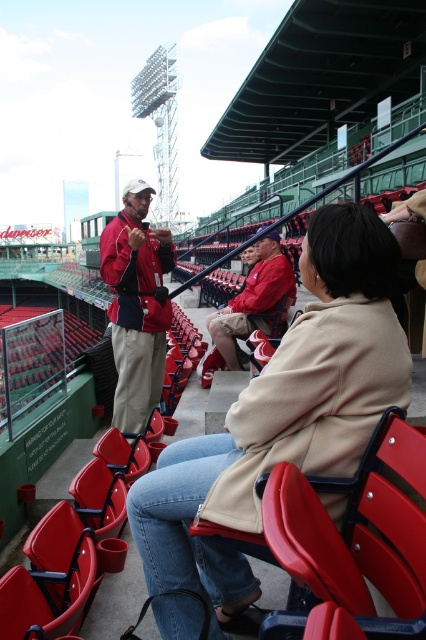
Question: Which of the following is the farthest from the observer?

Choices:
 (A) (135, 252)
 (B) (353, 609)
 (C) (235, 358)

Answer: (C)

Question: Is beige fabric coat at center wider than red fabric jacket at center?

Choices:
 (A) yes
 (B) no

Answer: (A)

Question: Is beige fabric coat at center wider than red fabric jacket at center?

Choices:
 (A) yes
 (B) no

Answer: (A)

Question: Which object is positioned closest to the matte red jacket at center?

Choices:
 (A) matte plastic chair at lower center
 (B) beige fabric coat at center
 (C) red fabric jacket at center

Answer: (C)

Question: Among these objects, which one is nearest to the camera?

Choices:
 (A) red fabric jacket at center
 (B) beige fabric coat at center
 (C) matte plastic chair at lower center
 (D) matte red jacket at center

Answer: (C)

Question: Is beige fabric coat at center above red fabric jacket at center?

Choices:
 (A) no
 (B) yes

Answer: (A)